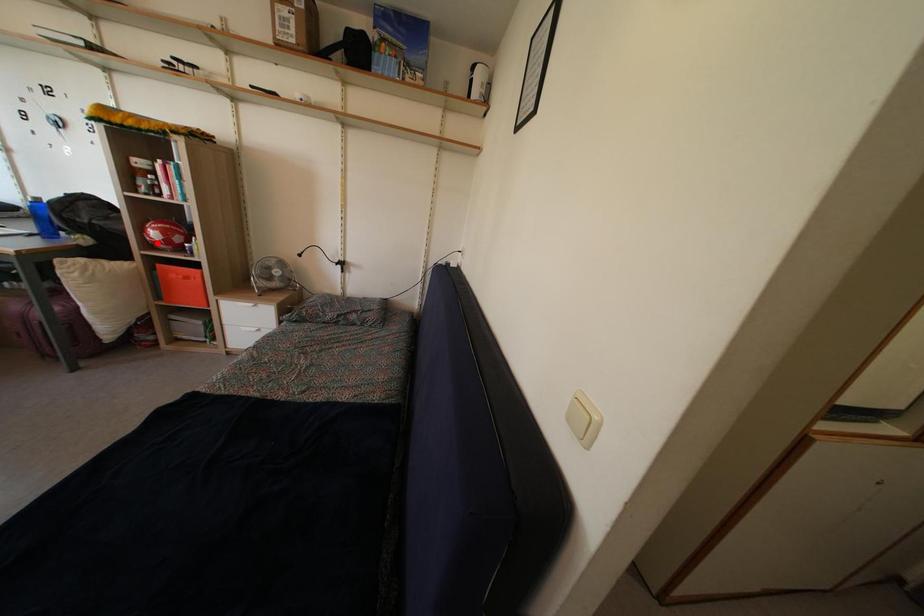
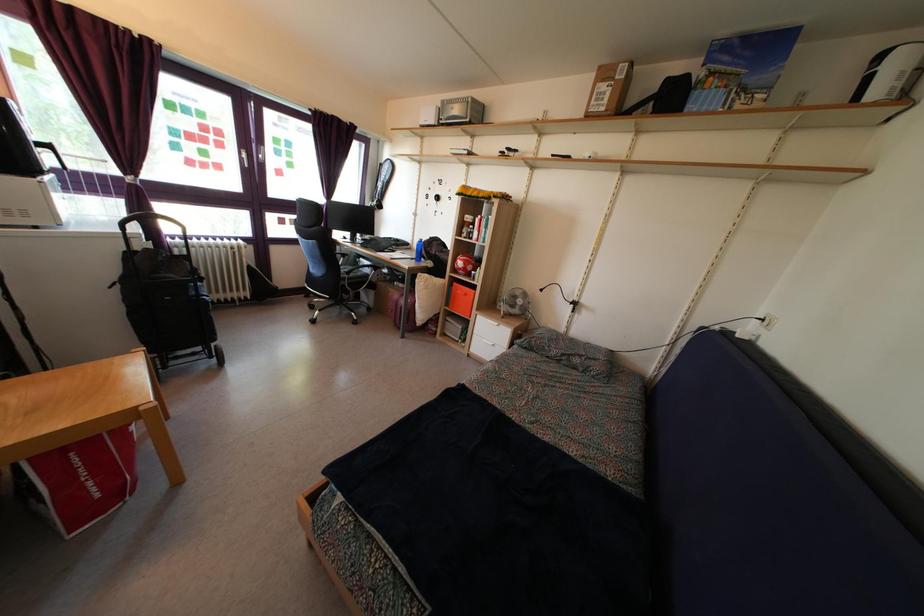
In the second image, find the point that corresponds to the highlighted location in the first image.

(463, 272)